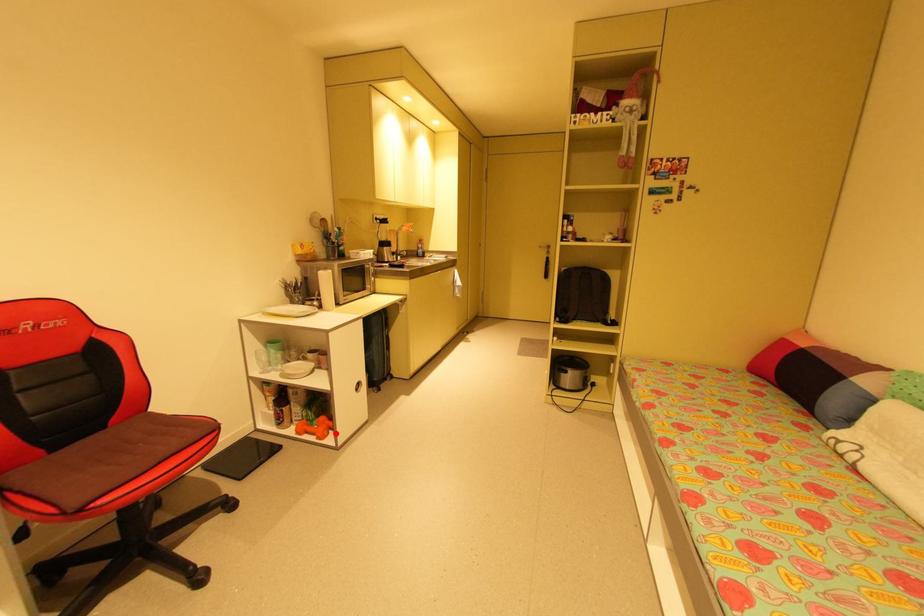
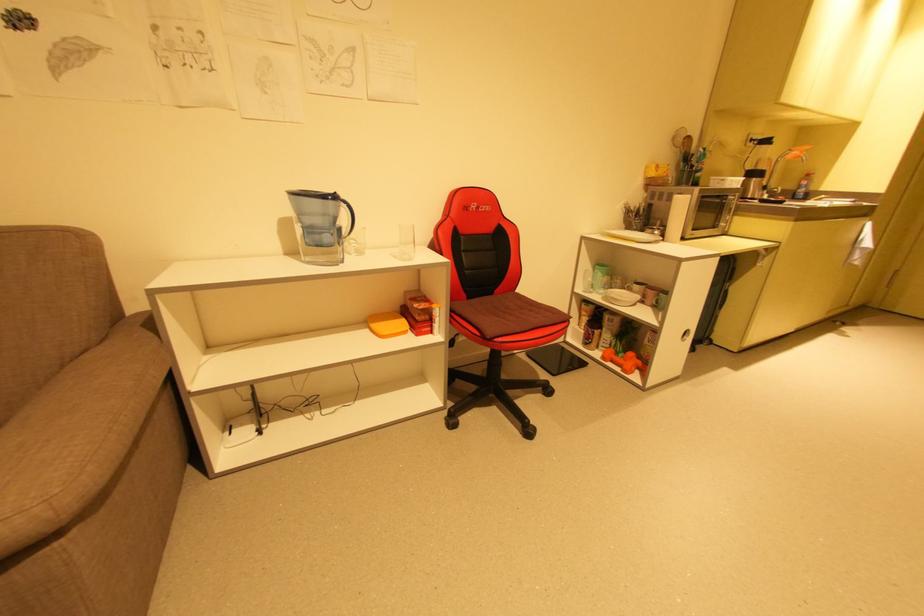
In the second image, find the point that corresponds to the highlighted location in the first image.

(641, 371)